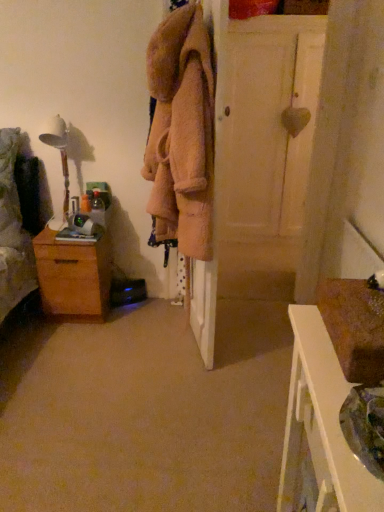
In order to click on free region under wooden table lamp at left (from a real-world perspective) in this screenshot , I will do `click(56, 225)`.